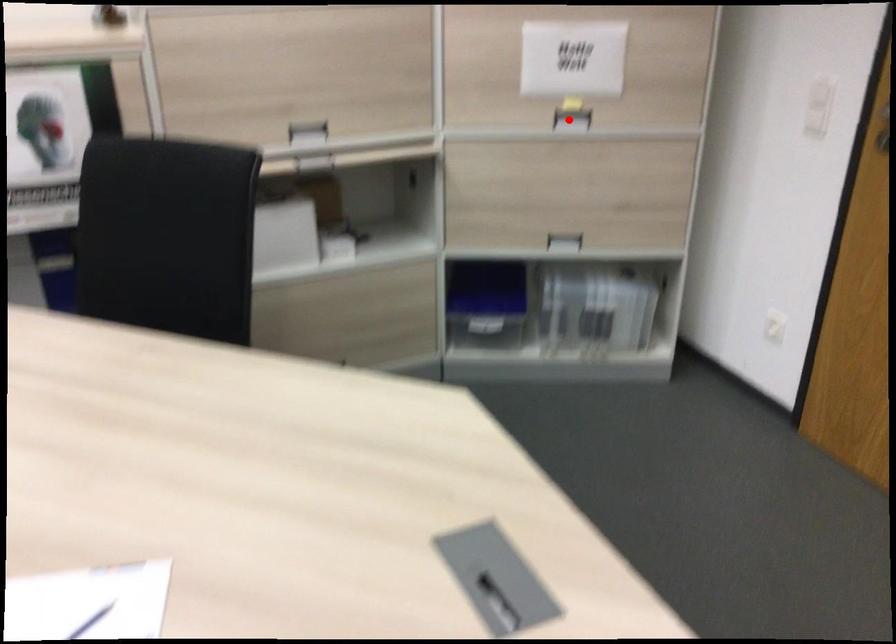
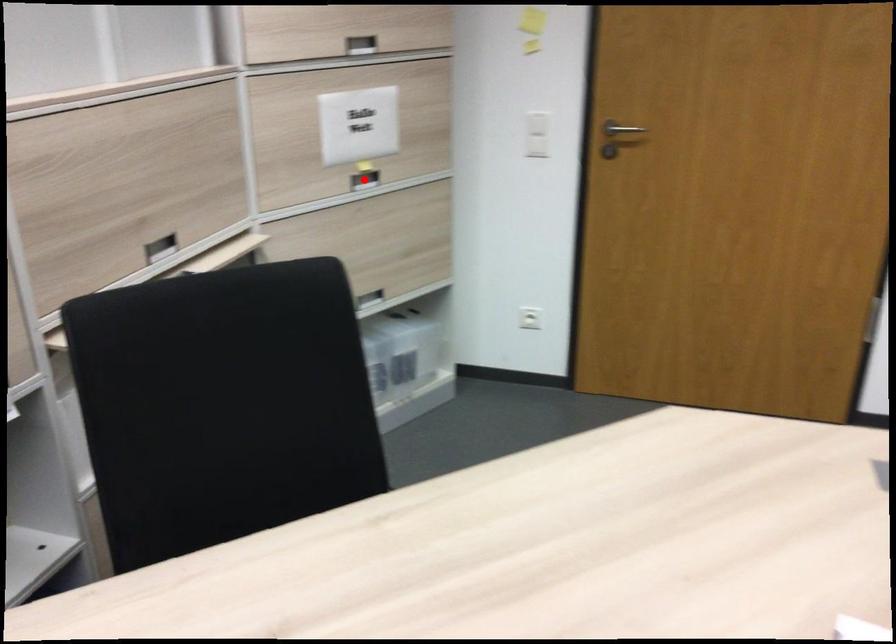
I am providing you with two images of the same scene from different viewpoints. A red point is marked on the first image and another point is marked on the second image. Are the points marked in image1 and image2 representing the same 3D position?

Yes